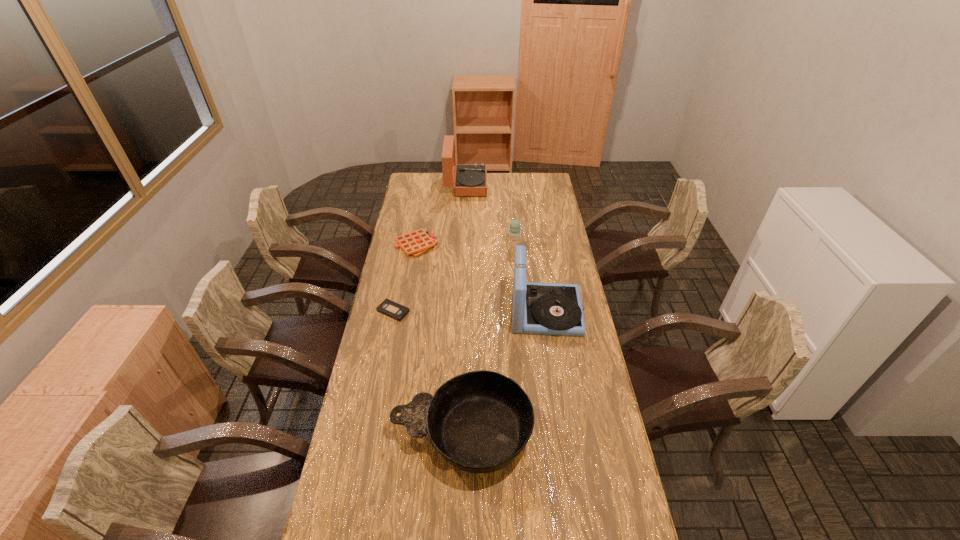
I want to click on the farther phonograph record, so click(470, 180).

Where is `the farthest object`? the farthest object is located at coordinates (470, 180).

You are a GUI agent. You are given a task and a screenshot of the screen. Output one action in this format:
    pyautogui.click(x=<x>, y=<y>)
    Task: Click on the nearer phonograph record
    The image size is (960, 540).
    Given the screenshot: What is the action you would take?
    pyautogui.click(x=556, y=309)

This screenshot has width=960, height=540. Find the location of `ice cream`. ice cream is located at coordinates (514, 232).

This screenshot has width=960, height=540. I want to click on frying pan, so pyautogui.click(x=479, y=421).

This screenshot has height=540, width=960. In order to click on the third shortest object in this screenshot , I will do `click(479, 421)`.

At what (x,y) coordinates should I click in order to perform the action: click on waffle. Please return your answer as a coordinate pair (x, y). The image size is (960, 540). Looking at the image, I should click on (415, 243).

Find the location of a particular element. The width and height of the screenshot is (960, 540). videotape is located at coordinates (388, 307).

Identify the location of vacant space positioned 0.110m on the face of the farther phonograph record. This screenshot has height=540, width=960. (506, 186).

You are a GUI agent. You are given a task and a screenshot of the screen. Output one action in this format:
    pyautogui.click(x=<x>, y=<y>)
    Task: Click on the vacant area located 0.110m on the front of the right phonograph record
    Image resolution: width=960 pixels, height=540 pixels.
    Given the screenshot: What is the action you would take?
    pyautogui.click(x=554, y=361)